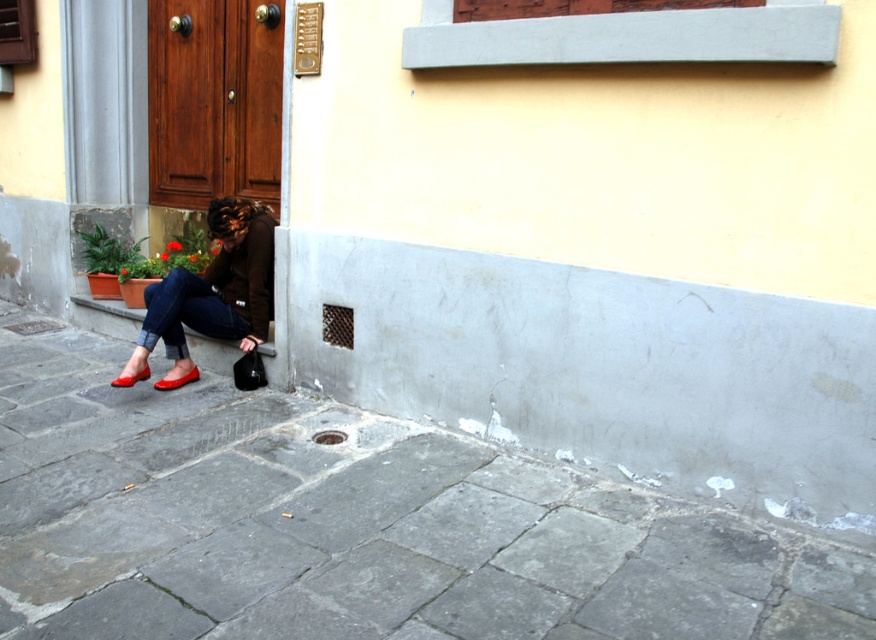
Is matte brown coat at lower left smaller than matte black bag at lower left?

No.

Find the location of `matte brown coat at lower left`. matte brown coat at lower left is located at coordinates (215, 289).

Which is more to the left, matte brown coat at lower left or matte red shoe at lower left?

matte red shoe at lower left is more to the left.

I want to click on matte brown coat at lower left, so click(215, 289).

Is point (269, 312) closer to camera compared to point (196, 372)?

Yes.

Where is `matte brown coat at lower left`? Image resolution: width=876 pixels, height=640 pixels. matte brown coat at lower left is located at coordinates (215, 289).

Is point (112, 307) more distant than point (172, 381)?

Yes, point (112, 307) is behind point (172, 381).

Is point (119, 305) positioned before point (193, 376)?

No, it is not.

In the scene shown: Who is more distant from viewer, (90, 298) or (177, 387)?

Point (90, 298)

Where is `matte black bag at lower left`? Image resolution: width=876 pixels, height=640 pixels. matte black bag at lower left is located at coordinates (110, 307).